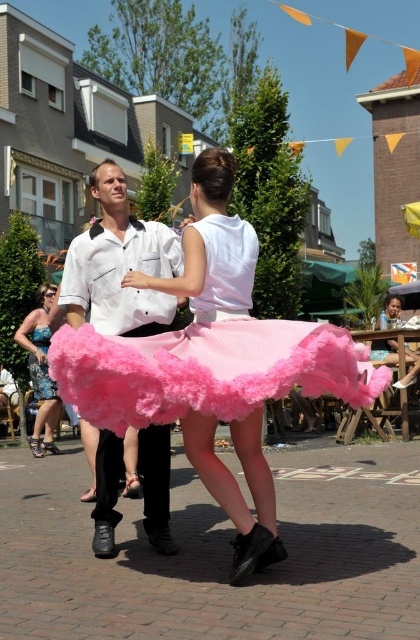
Question: Estimate the real-world distances between objects in this image. Which object is closer to the white matte shirt at center?

Choices:
 (A) shiny blue dress at lower left
 (B) fuzzy pink skirt at center

Answer: (B)

Question: Is white matte shirt at center above shiny blue dress at lower left?

Choices:
 (A) yes
 (B) no

Answer: (A)

Question: Which point appears closest to the camera in this image?

Choices:
 (A) (236, 307)
 (B) (49, 440)

Answer: (A)

Question: Estimate the real-world distances between objects in this image. Which object is farther from the white matte shirt at center?

Choices:
 (A) fuzzy pink skirt at center
 (B) shiny blue dress at lower left

Answer: (B)

Question: Does white matte shirt at center have a greater width compared to shiny blue dress at lower left?

Choices:
 (A) no
 (B) yes

Answer: (A)

Question: Does white matte shirt at center appear on the left side of shiny blue dress at lower left?

Choices:
 (A) no
 (B) yes

Answer: (A)